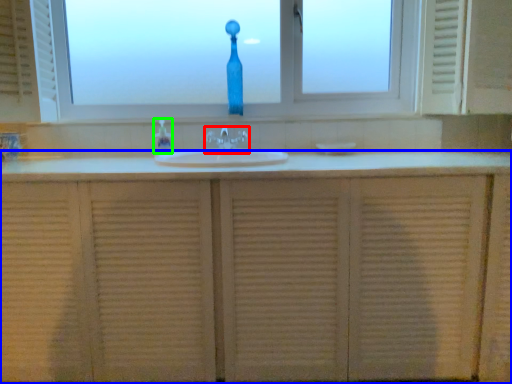
Question: Which object is the closest to the tap (highlighted by a red box)? Choose among these: bathroom cabinet (highlighted by a blue box) or soap dispenser (highlighted by a green box).

Choices:
 (A) bathroom cabinet
 (B) soap dispenser

Answer: (B)